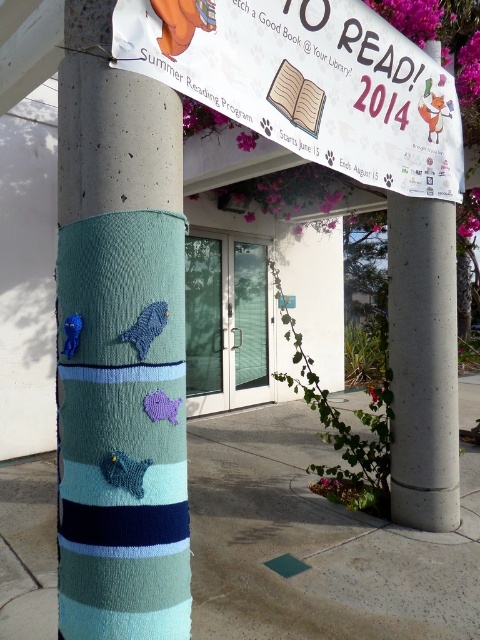
Which of these two, teal knitted yarn at center or white paper banner at upper center, stands shorter?

With less height is white paper banner at upper center.

Is teal knitted yarn at center further to camera compared to white paper banner at upper center?

No, it is not.

Where is `teal knitted yarn at center`? This screenshot has width=480, height=640. teal knitted yarn at center is located at coordinates (119, 346).

Can you confirm if white paper banner at upper center is positioned above concrete at right?

Correct, white paper banner at upper center is located above concrete at right.

What do you see at coordinates (308, 83) in the screenshot?
I see `white paper banner at upper center` at bounding box center [308, 83].

What are the coordinates of `white paper banner at upper center` in the screenshot? It's located at (308, 83).

Which is behind, point (90, 378) or point (432, 330)?

The point (432, 330) is more distant.

Does teal knitted yarn at center lie in front of concrete at right?

Yes, teal knitted yarn at center is closer to the viewer.

Where is `teal knitted yarn at center`? The height and width of the screenshot is (640, 480). teal knitted yarn at center is located at coordinates (119, 346).